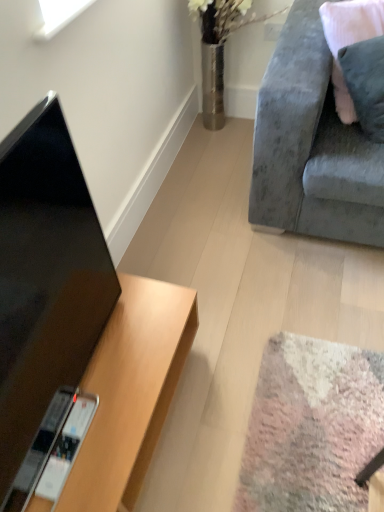
Question: Is velvet grey couch at upper right surrounding wooden desk at lower left?

Choices:
 (A) no
 (B) yes

Answer: (A)

Question: From the image's perspective, would you say velvet grey couch at upper right is shown under wooden desk at lower left?

Choices:
 (A) no
 (B) yes

Answer: (A)

Question: Can you confirm if velvet grey couch at upper right is wider than wooden desk at lower left?

Choices:
 (A) yes
 (B) no

Answer: (A)

Question: From a real-world perspective, is velvet grey couch at upper right below wooden desk at lower left?

Choices:
 (A) no
 (B) yes

Answer: (A)

Question: Are velvet grey couch at upper right and wooden desk at lower left located far from each other?

Choices:
 (A) no
 (B) yes

Answer: (A)

Question: Is velvet grey couch at upper right smaller than wooden desk at lower left?

Choices:
 (A) no
 (B) yes

Answer: (A)

Question: From a real-world perspective, does black glossy tv at left sit lower than wooden desk at lower left?

Choices:
 (A) no
 (B) yes

Answer: (A)

Question: Can you confirm if black glossy tv at left is smaller than wooden desk at lower left?

Choices:
 (A) no
 (B) yes

Answer: (B)

Question: Is black glossy tv at left thinner than wooden desk at lower left?

Choices:
 (A) yes
 (B) no

Answer: (A)

Question: Does black glossy tv at left have a lesser height compared to wooden desk at lower left?

Choices:
 (A) yes
 (B) no

Answer: (B)

Question: Can you confirm if black glossy tv at left is bigger than wooden desk at lower left?

Choices:
 (A) yes
 (B) no

Answer: (B)

Question: From a real-world perspective, is black glossy tv at left physically above wooden desk at lower left?

Choices:
 (A) no
 (B) yes

Answer: (B)

Question: Does velvet pink pillow at upper right have a larger size compared to velvet grey couch at upper right?

Choices:
 (A) no
 (B) yes

Answer: (A)